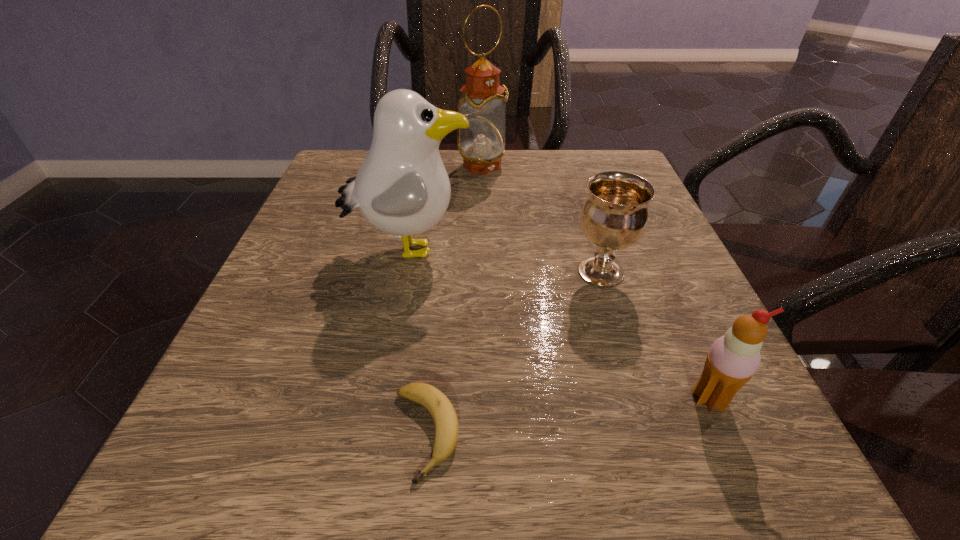
Find the location of a particular element. object that is at the far edge is located at coordinates (481, 145).

Locate an element on the screen. Image resolution: width=960 pixels, height=540 pixels. object situated at the near edge is located at coordinates (444, 415).

What are the coordinates of `object located in the left edge section of the desktop` in the screenshot? It's located at (402, 188).

This screenshot has width=960, height=540. I want to click on chalice located in the right edge section of the desktop, so click(614, 216).

Where is `icecream present at the right edge`? The height and width of the screenshot is (540, 960). icecream present at the right edge is located at coordinates (733, 359).

In the image, there is a desktop. Identify the location of free space at the far edge. The width and height of the screenshot is (960, 540). (539, 177).

The height and width of the screenshot is (540, 960). In the image, there is a desktop. Identify the location of free space at the near edge. coord(492,501).

The height and width of the screenshot is (540, 960). In the image, there is a desktop. Find the location of `vacant space at the left edge`. vacant space at the left edge is located at coordinates (263, 295).

You are a GUI agent. You are given a task and a screenshot of the screen. Output one action in this format:
    pyautogui.click(x=<x>, y=<y>)
    Task: Click on the free location at the right edge of the desktop
    
    Given the screenshot: What is the action you would take?
    pyautogui.click(x=702, y=333)

Locate an element on the screen. The height and width of the screenshot is (540, 960). vacant space at the far left corner of the desktop is located at coordinates (355, 160).